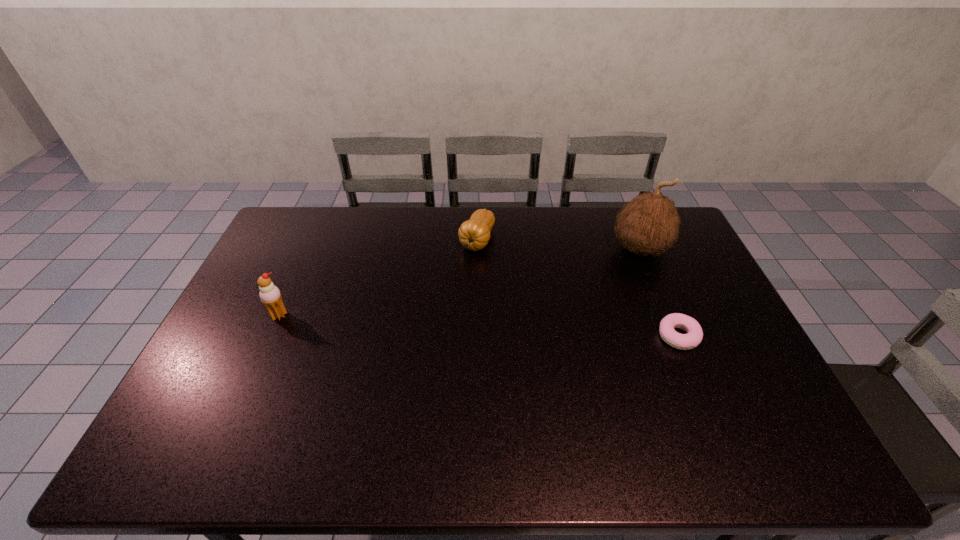
Locate an element on the screen. The height and width of the screenshot is (540, 960). icecream is located at coordinates (269, 294).

What are the coordinates of `the second tallest object` in the screenshot? It's located at (269, 294).

Where is `pastry`? Image resolution: width=960 pixels, height=540 pixels. pastry is located at coordinates (692, 339).

At what (x,y) coordinates should I click in order to perform the action: click on the tallest object. Please return your answer as a coordinate pair (x, y). The height and width of the screenshot is (540, 960). Looking at the image, I should click on (649, 224).

I want to click on the second object from left to right, so click(474, 234).

The image size is (960, 540). I want to click on the third tallest object, so click(474, 234).

Locate an element on the screen. The image size is (960, 540). free space located 0.060m at the front with a straw on the second tallest object is located at coordinates (269, 338).

Where is `vacant region located on the back of the shortest object`? The width and height of the screenshot is (960, 540). vacant region located on the back of the shortest object is located at coordinates (665, 306).

At what (x,y) coordinates should I click in order to perform the action: click on vacant space located on the surface of the tallest object. Please return your answer as a coordinate pair (x, y). The image size is (960, 540). Looking at the image, I should click on (609, 265).

Locate an element on the screen. The height and width of the screenshot is (540, 960). free space located on the surface of the tallest object is located at coordinates (581, 280).